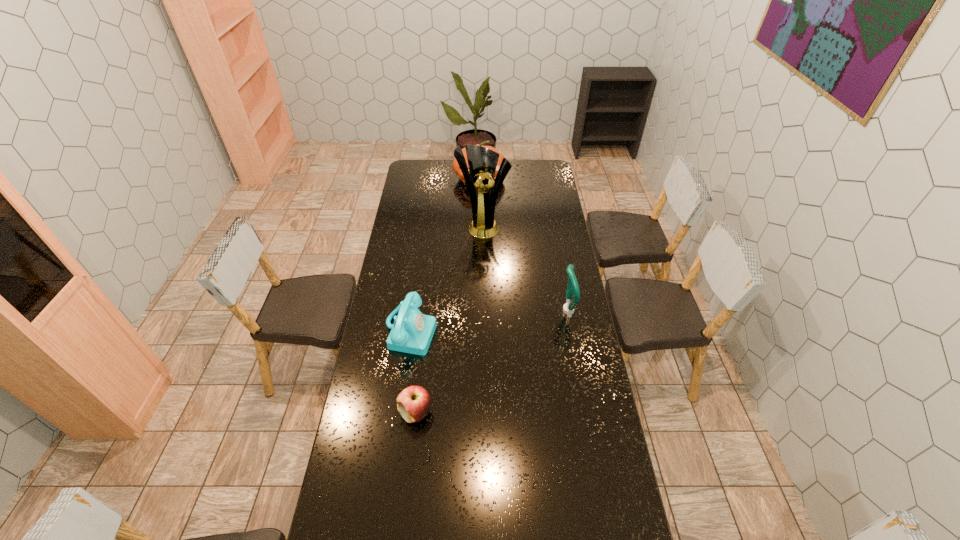
You are a GUI agent. You are given a task and a screenshot of the screen. Output one action in this format:
    pyautogui.click(x=<x>, y=<y>)
    Task: Click on the free space located 0.220m at the jaws of the bottle opener
    The height and width of the screenshot is (540, 960).
    Given the screenshot: What is the action you would take?
    pyautogui.click(x=508, y=310)

What are the coordinates of `vacant area situated at the jaws of the bottle opener` in the screenshot? It's located at (477, 310).

Locate an element on the screen. The image size is (960, 540). free spot located at the jaws of the bottle opener is located at coordinates (473, 310).

Find the location of `vacant area located on the dial of the fourth tallest object`. vacant area located on the dial of the fourth tallest object is located at coordinates [x=517, y=350].

I want to click on free point located on the dial of the fourth tallest object, so click(500, 347).

Locate an element on the screen. The image size is (960, 540). free space located on the dial of the fourth tallest object is located at coordinates (471, 342).

Locate an element on the screen. vacant area situated 0.310m at the front of the award, where the globe is visible is located at coordinates (499, 281).

You are a GUI agent. You are given a task and a screenshot of the screen. Output one action in this format:
    pyautogui.click(x=<x>, y=<y>)
    Task: Click on the vacant space situated at the front of the award, where the globe is visible
    This screenshot has height=540, width=960.
    Given the screenshot: What is the action you would take?
    pyautogui.click(x=490, y=246)

This screenshot has height=540, width=960. In order to click on free space located 0.330m at the front of the award, where the globe is visible in this screenshot , I will do `click(500, 284)`.

Find the location of a particular element. This screenshot has height=540, width=960. vacant space located 0.200m on the front face of the pumpkin is located at coordinates (486, 214).